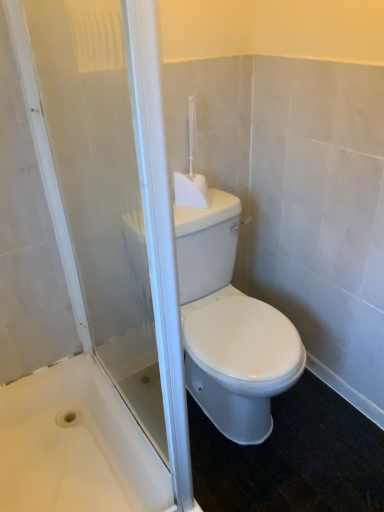
Question: From a real-world perspective, is transparent glass screen door at center physically located above or below white glossy bathtub at lower left?

Choices:
 (A) above
 (B) below

Answer: (A)

Question: In terms of width, does transparent glass screen door at center look wider or thinner when compared to white glossy bathtub at lower left?

Choices:
 (A) wide
 (B) thin

Answer: (B)

Question: Based on their relative distances, which object is nearer to the white plastic toilet brush at upper center?

Choices:
 (A) transparent glass screen door at center
 (B) white glossy toilet at center
 (C) white glossy bathtub at lower left

Answer: (B)

Question: Considering the real-world distances, which object is closest to the white plastic toilet brush at upper center?

Choices:
 (A) white glossy bathtub at lower left
 (B) white glossy toilet at center
 (C) transparent glass screen door at center

Answer: (B)